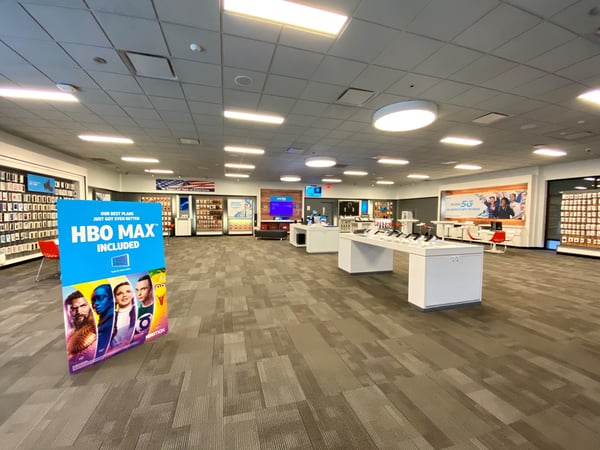
Identify the location of chairs. (46, 252), (499, 239), (472, 239), (502, 233), (454, 228).